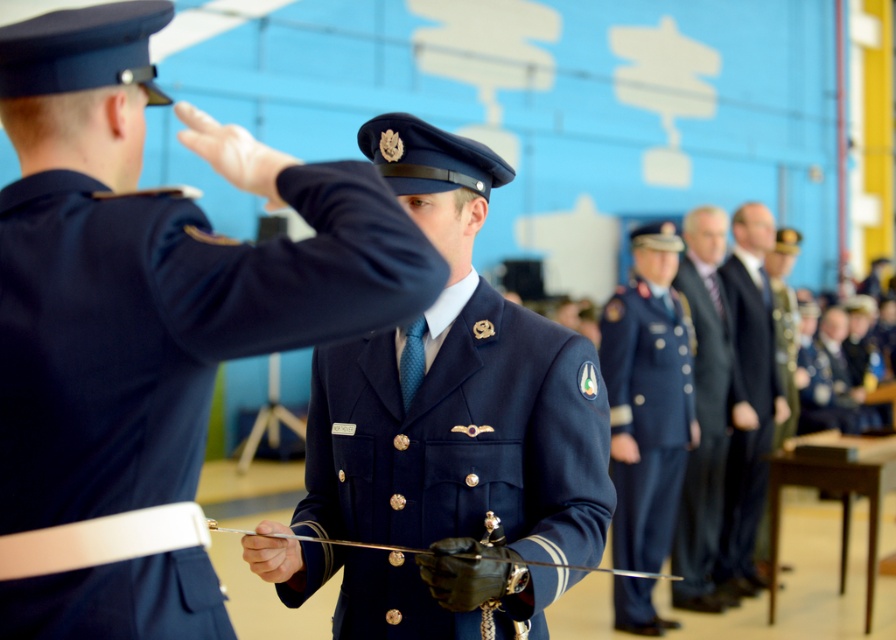
Between point (98, 289) and point (638, 545), which one is positioned in front?

Point (98, 289) is in front.

The width and height of the screenshot is (896, 640). Describe the element at coordinates (153, 273) in the screenshot. I see `navy blue uniform at center` at that location.

The width and height of the screenshot is (896, 640). I want to click on navy blue uniform at center, so click(x=153, y=273).

Between blue fabric uniform at center and dark blue suit at center, which one has less height?

With less height is blue fabric uniform at center.

Is blue fabric uniform at center to the left of dark blue suit at center from the viewer's perspective?

Yes, blue fabric uniform at center is to the left of dark blue suit at center.

Measure the distance between point (626,337) and camera.

A distance of 9.09 meters exists between point (626,337) and camera.

In order to click on blue fabric uniform at center in this screenshot , I will do pos(645,417).

Can you confirm if navy blue uniform at center is smaller than dark gray suit at center?

Correct, navy blue uniform at center occupies less space than dark gray suit at center.

Is navy blue uniform at center positioned in front of dark gray suit at center?

Yes, it is in front of dark gray suit at center.

This screenshot has height=640, width=896. Identify the location of navy blue uniform at center. (153, 273).

Identify the location of navy blue uniform at center. The width and height of the screenshot is (896, 640). (153, 273).